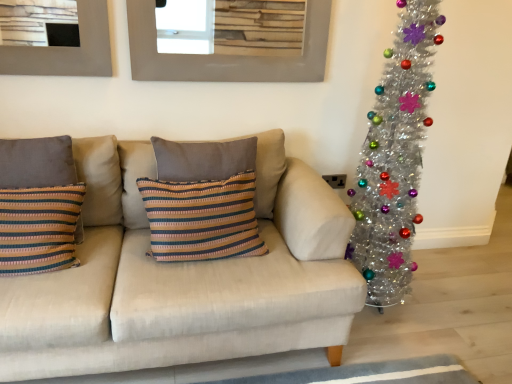
Question: From the image's perspective, is striped fabric cushion at center, placed as the 1th pillow when sorted from right to left, above or below shiny silver christmas tree at right?

Choices:
 (A) above
 (B) below

Answer: (B)

Question: From a real-world perspective, relative to shiny silver christmas tree at right, is striped fabric cushion at center, placed as the 1th pillow when sorted from right to left, vertically above or below?

Choices:
 (A) below
 (B) above

Answer: (A)

Question: Which of these objects is positioned farthest from the beige fabric couch at center?

Choices:
 (A) striped fabric cushion at left, the 2th pillow when ordered from right to left
 (B) shiny silver christmas tree at right
 (C) matte gray picture frame at upper center
 (D) striped fabric cushion at center, placed as the 1th pillow when sorted from right to left

Answer: (C)

Question: Which object is positioned farthest from the beige fabric couch at center?

Choices:
 (A) shiny silver christmas tree at right
 (B) striped fabric cushion at center, placed as the 2th pillow when sorted from left to right
 (C) matte gray picture frame at upper center
 (D) striped fabric cushion at left, the 2th pillow when ordered from right to left

Answer: (C)